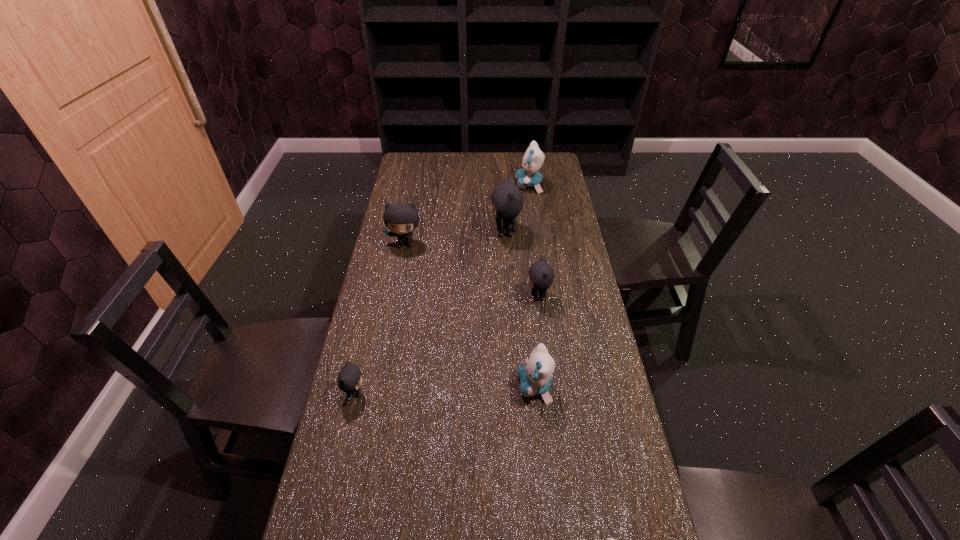
The image size is (960, 540). Identify the location of free area in between the farthest object and the smallest gray kitten. (443, 289).

Find the location of a particular element. vacant space that's between the second smallest blue kitten and the third smallest gray kitten is located at coordinates (470, 315).

At what (x,y) coordinates should I click in order to perform the action: click on vacant point located between the biggest gray kitten and the second biggest blue kitten. Please return your answer as a coordinate pair (x, y). The height and width of the screenshot is (540, 960). Looking at the image, I should click on (520, 309).

Where is `the fifth closest object to the farthest object`? This screenshot has height=540, width=960. the fifth closest object to the farthest object is located at coordinates (350, 377).

Find the location of a particular element. This screenshot has width=960, height=540. the fourth closest object to the farthest kitten is located at coordinates (535, 377).

Locate which kitten ranks sixth in proximity to the second nearest blue kitten. Please provide its 2D coordinates. Your answer should be formatted as a tuple, i.e. [(x, y)], where the tuple contains the x and y coordinates of a point satisfying the conditions above.

[(533, 158)]

Where is `kitten that stands as the sixth closest to the smallest gray kitten`? The width and height of the screenshot is (960, 540). kitten that stands as the sixth closest to the smallest gray kitten is located at coordinates [x=533, y=158].

Locate which gray kitten is the second closest to the smallest gray kitten. Please provide its 2D coordinates. Your answer should be formatted as a tuple, i.e. [(x, y)], where the tuple contains the x and y coordinates of a point satisfying the conditions above.

[(400, 218)]

Identify the location of the second closest gray kitten relative to the fourth farthest kitten. point(400,218).

Where is `blue kitten that stands as the second closest to the second farthest blue kitten`? blue kitten that stands as the second closest to the second farthest blue kitten is located at coordinates (533, 158).